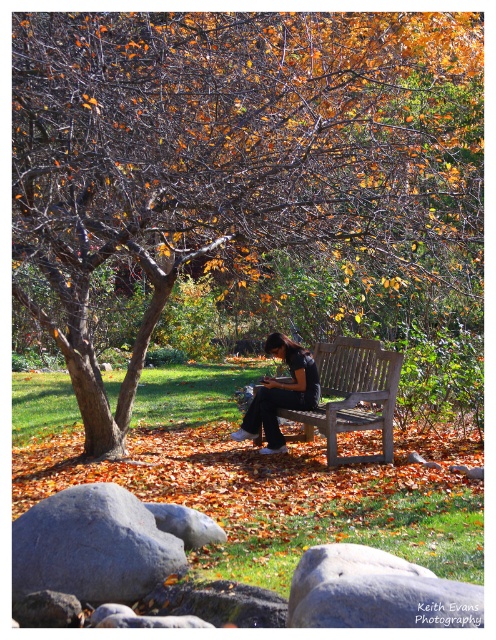
Question: Which point is farther from the camera taking this photo?

Choices:
 (A) (369, 209)
 (B) (354, 410)

Answer: (B)

Question: Is wooden bench at center further to the viewer compared to black fabric shirt at center?

Choices:
 (A) no
 (B) yes

Answer: (A)

Question: Is brown wood tree at center smaller than black fabric shirt at center?

Choices:
 (A) yes
 (B) no

Answer: (A)

Question: Which is farther from the black fabric shirt at center?

Choices:
 (A) wooden bench at center
 (B) brown wood tree at center

Answer: (B)

Question: Among these points, which one is farthest from the camera?

Choices:
 (A) (345, 236)
 (B) (276, 444)

Answer: (B)

Question: Does wooden bench at center appear under black fabric shirt at center?

Choices:
 (A) no
 (B) yes

Answer: (A)